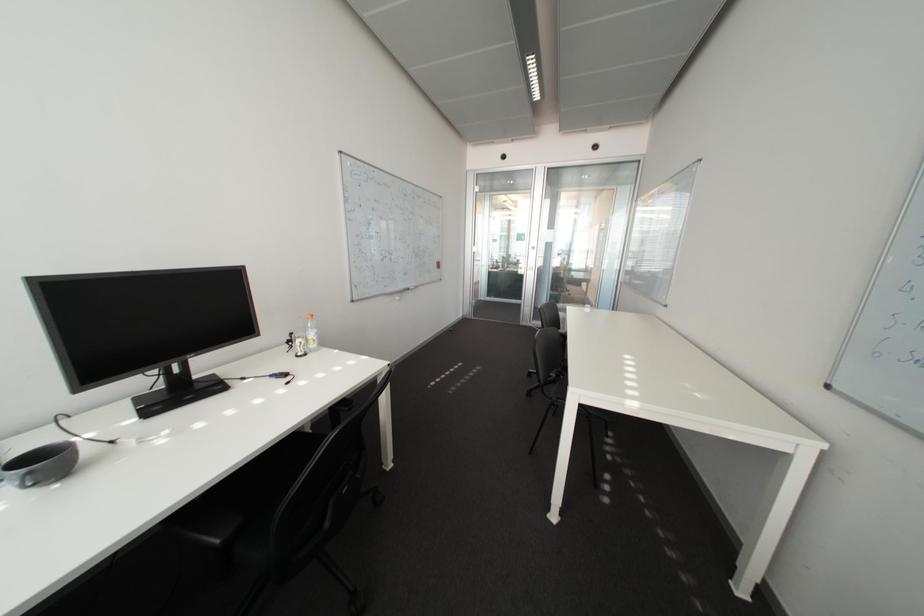
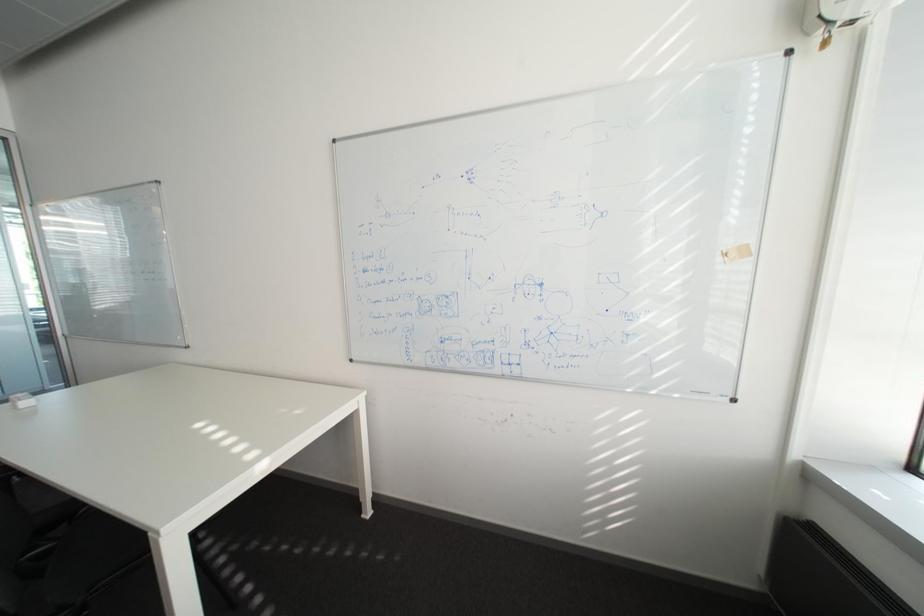
Question: The camera is either moving clockwise (left) or counter-clockwise (right) around the object. The first image is from the beginning of the video and the second image is from the end. Is the camera moving left or right when shooting the video?

Choices:
 (A) Left
 (B) Right

Answer: (A)